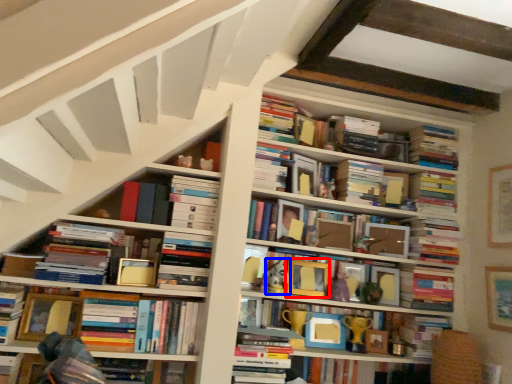
Question: Which of the following is the farthest to the observer, picture frame (highlighted by a red box) or toy (highlighted by a blue box)?

Choices:
 (A) picture frame
 (B) toy

Answer: (A)